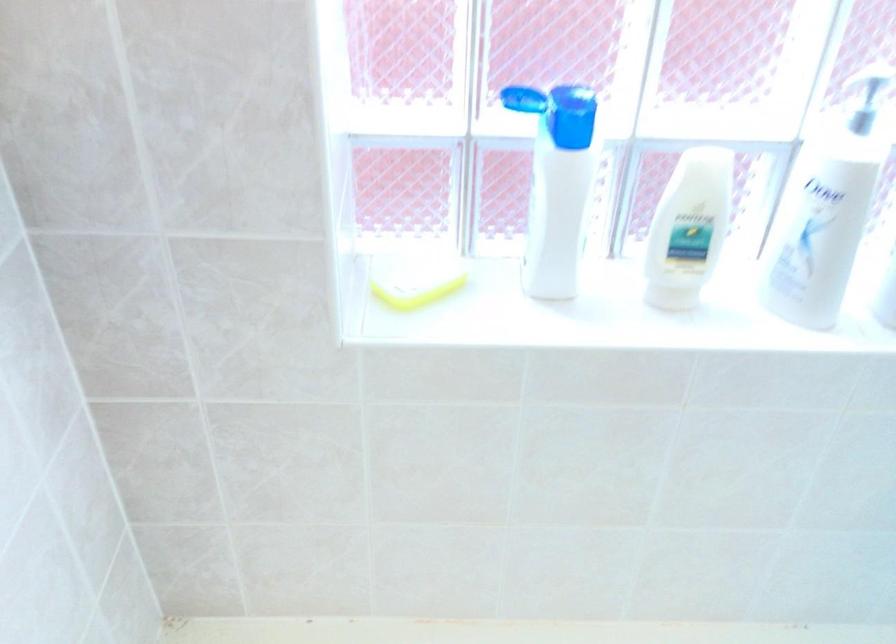
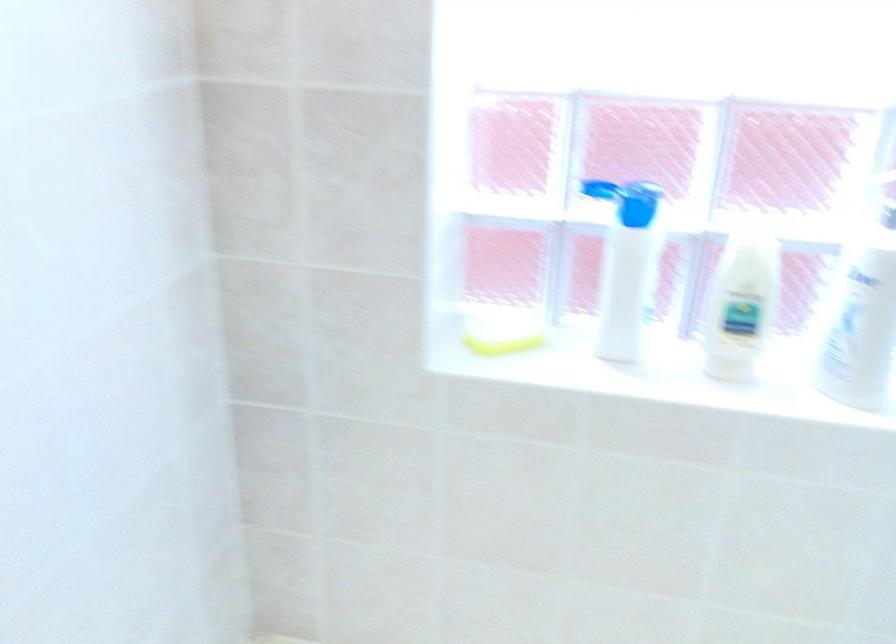
The point at (572, 122) is marked in the first image. Where is the corresponding point in the second image?

(636, 203)